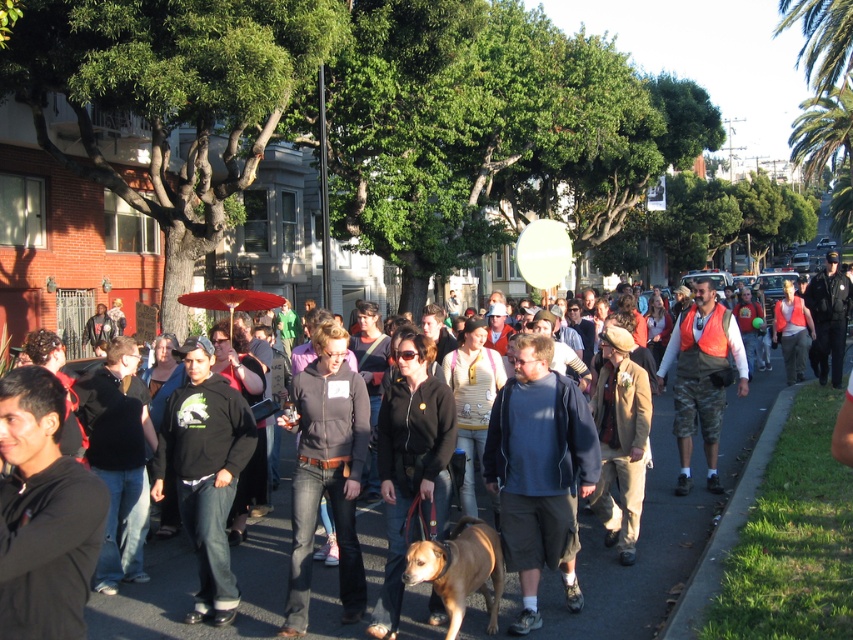
Question: Can you confirm if camouflage shorts at center is positioned below brown furry dog at center?

Choices:
 (A) no
 (B) yes

Answer: (A)

Question: Where is smooth asphalt pavement at center located in relation to brown furry dog at center in the image?

Choices:
 (A) below
 (B) above

Answer: (A)

Question: Is smooth asphalt pavement at center thinner than brown furry dog at center?

Choices:
 (A) no
 (B) yes

Answer: (A)

Question: Which object is farther from the camera taking this photo?

Choices:
 (A) smooth asphalt pavement at center
 (B) camouflage shorts at center
 (C) brown furry dog at center

Answer: (B)

Question: Which point is closer to the camera taking this photo?

Choices:
 (A) (706, 314)
 (B) (428, 579)
 (C) (422, 625)
 (D) (534, 618)

Answer: (B)

Question: Which of the following is the closest to the observer?

Choices:
 (A) (553, 525)
 (B) (496, 602)
 (C) (708, 403)

Answer: (A)